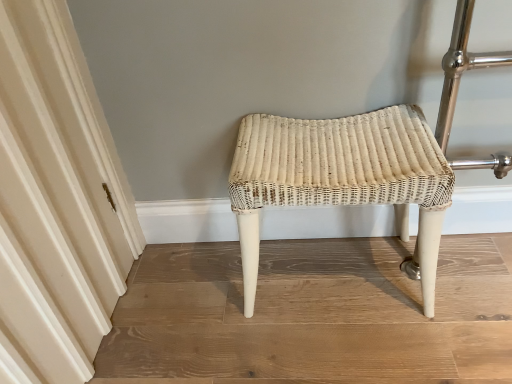
Where is `free location to the left of white wicker stool at center`? The width and height of the screenshot is (512, 384). free location to the left of white wicker stool at center is located at coordinates (205, 303).